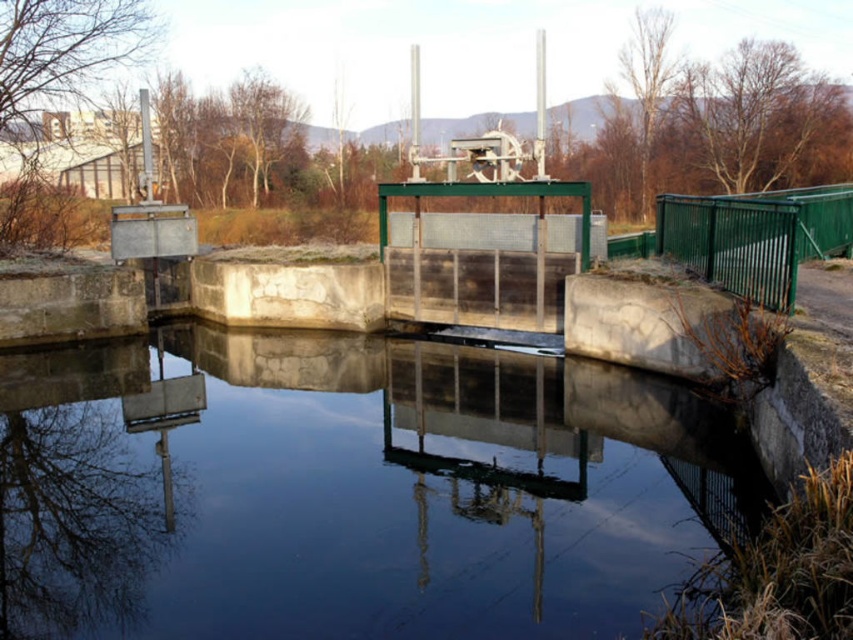
Based on the scene described, which object, the transparent water at center or the green metallic fence at right, occupies a larger horizontal space in the image?

The transparent water at center might be wider than green metallic fence at right according to the description.

You are standing at the edge of the water management structure and want to take a photo of the transparent water at center and the green metallic fence at right. Which object will appear larger in your photo?

The transparent water at center will appear larger in the photo because it is closer to the viewer than the green metallic fence at right.